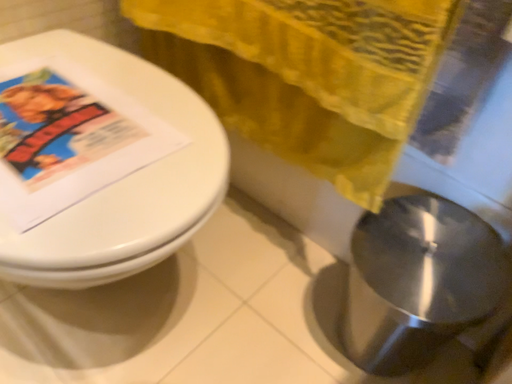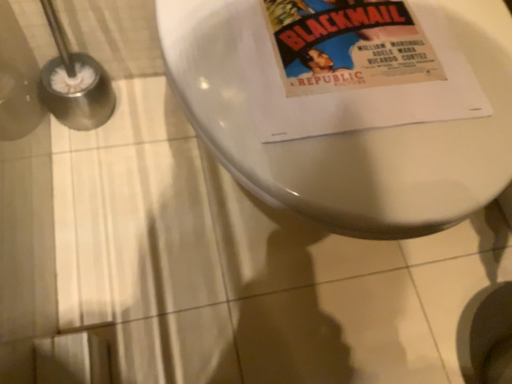
Question: Which way did the camera rotate in the video?

Choices:
 (A) rotated downward
 (B) rotated upward

Answer: (A)